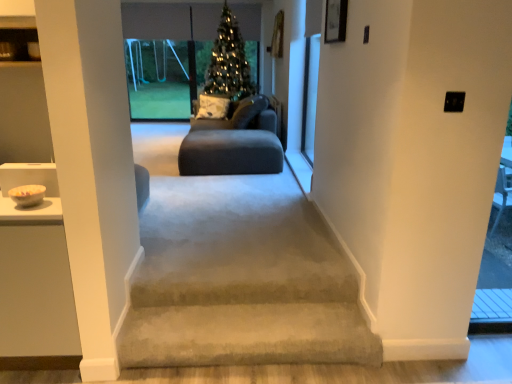
Question: Is transparent glass swing set at upper center at the back of green matte christmas tree at center?

Choices:
 (A) yes
 (B) no

Answer: (B)

Question: Considering the relative positions of green matte christmas tree at center and transparent glass swing set at upper center in the image provided, is green matte christmas tree at center in front of transparent glass swing set at upper center?

Choices:
 (A) no
 (B) yes

Answer: (B)

Question: From a real-world perspective, is green matte christmas tree at center located higher than transparent glass swing set at upper center?

Choices:
 (A) no
 (B) yes

Answer: (B)

Question: From the image's perspective, would you say green matte christmas tree at center is shown under transparent glass swing set at upper center?

Choices:
 (A) yes
 (B) no

Answer: (A)

Question: Considering the relative sizes of green matte christmas tree at center and transparent glass swing set at upper center in the image provided, is green matte christmas tree at center shorter than transparent glass swing set at upper center?

Choices:
 (A) no
 (B) yes

Answer: (A)

Question: Do you think transparent glass screen door at upper right is within white textured pillow at center, or outside of it?

Choices:
 (A) inside
 (B) outside

Answer: (B)

Question: In the image, is transparent glass screen door at upper right on the left side or the right side of white textured pillow at center?

Choices:
 (A) right
 (B) left

Answer: (A)

Question: Considering the positions of point pyautogui.click(x=306, y=132) and point pyautogui.click(x=219, y=114), is point pyautogui.click(x=306, y=132) closer or farther from the camera than point pyautogui.click(x=219, y=114)?

Choices:
 (A) farther
 (B) closer

Answer: (B)

Question: Considering their positions, is transparent glass screen door at upper right located in front of or behind white textured pillow at center?

Choices:
 (A) behind
 (B) front

Answer: (B)

Question: Visually, is transparent glass swing set at upper center positioned to the left or to the right of white textured pillow at center?

Choices:
 (A) right
 (B) left

Answer: (B)

Question: From a real-world perspective, is transparent glass swing set at upper center physically located above or below white textured pillow at center?

Choices:
 (A) below
 (B) above

Answer: (B)

Question: Is transparent glass swing set at upper center in front of or behind white textured pillow at center in the image?

Choices:
 (A) front
 (B) behind

Answer: (B)

Question: In terms of height, does transparent glass swing set at upper center look taller or shorter compared to white textured pillow at center?

Choices:
 (A) tall
 (B) short

Answer: (A)

Question: Is white textured pillow at center wider or thinner than green matte christmas tree at center?

Choices:
 (A) thin
 (B) wide

Answer: (A)

Question: Is white textured pillow at center taller or shorter than green matte christmas tree at center?

Choices:
 (A) tall
 (B) short

Answer: (B)